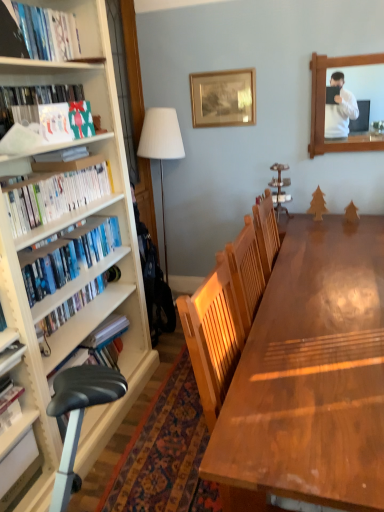
Question: From the image's perspective, would you say wooden frame at upper right is positioned over white glossy bookshelf at left, the 3th book positioned from the top?

Choices:
 (A) yes
 (B) no

Answer: (A)

Question: Is wooden frame at upper right closer to camera compared to white glossy bookshelf at left, the 3th book positioned from the top?

Choices:
 (A) yes
 (B) no

Answer: (B)

Question: From the image's perspective, is wooden frame at upper right beneath white glossy bookshelf at left, the 3th book positioned from the top?

Choices:
 (A) no
 (B) yes

Answer: (A)

Question: Would you consider wooden frame at upper right to be distant from white glossy bookshelf at left, the third book ordered from the bottom?

Choices:
 (A) no
 (B) yes

Answer: (B)

Question: From a real-world perspective, is wooden frame at upper right under white glossy bookshelf at left, the 3th book positioned from the top?

Choices:
 (A) yes
 (B) no

Answer: (B)

Question: Visually, is shiny brown wooden table at center positioned to the left or to the right of blue matte bookshelf at left, which is the fourth book in top-to-bottom order?

Choices:
 (A) right
 (B) left

Answer: (A)

Question: From their relative heights in the image, would you say shiny brown wooden table at center is taller or shorter than blue matte bookshelf at left, which is the fourth book in top-to-bottom order?

Choices:
 (A) short
 (B) tall

Answer: (B)

Question: Looking at the image, does shiny brown wooden table at center seem bigger or smaller compared to blue matte bookshelf at left, which is the fourth book in top-to-bottom order?

Choices:
 (A) small
 (B) big

Answer: (B)

Question: From a real-world perspective, is shiny brown wooden table at center positioned above or below blue matte bookshelf at left, arranged as the second book when ordered from the bottom?

Choices:
 (A) above
 (B) below

Answer: (B)

Question: Is shiny brown wooden table at center inside or outside of wooden frame at upper right?

Choices:
 (A) inside
 (B) outside

Answer: (B)

Question: In terms of width, does shiny brown wooden table at center look wider or thinner when compared to wooden frame at upper right?

Choices:
 (A) thin
 (B) wide

Answer: (B)

Question: Does point (x=339, y=258) appear closer or farther from the camera than point (x=331, y=56)?

Choices:
 (A) farther
 (B) closer

Answer: (B)

Question: From the image's perspective, relative to wooden frame at upper right, is shiny brown wooden table at center above or below?

Choices:
 (A) below
 (B) above

Answer: (A)

Question: Considering the positions of point (74, 253) and point (332, 65), is point (74, 253) closer or farther from the camera than point (332, 65)?

Choices:
 (A) closer
 (B) farther

Answer: (A)

Question: From the image's perspective, is blue matte bookshelf at left, arranged as the second book when ordered from the bottom, positioned above or below wooden frame at upper right?

Choices:
 (A) above
 (B) below

Answer: (B)